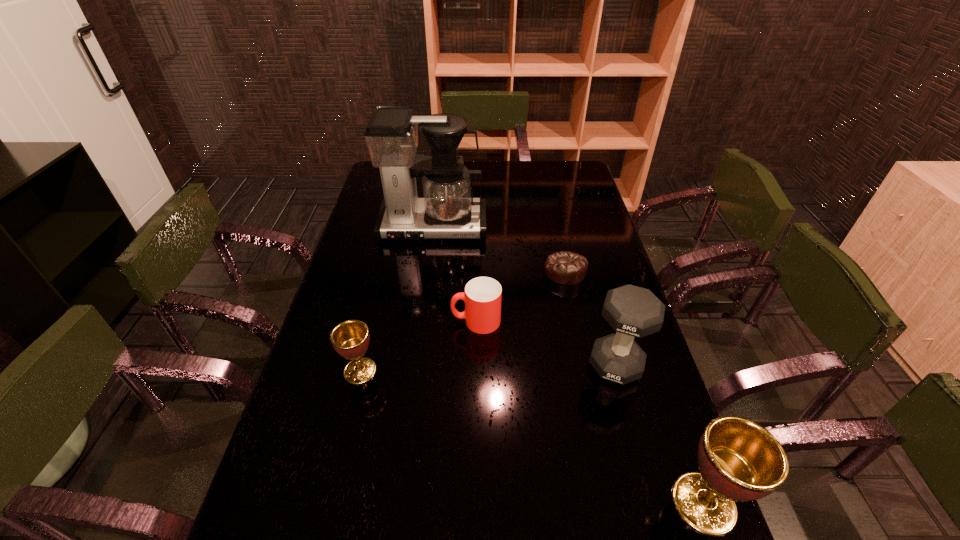
Where is `vacant area that lies between the shorter chalice and the dumbbell`? The width and height of the screenshot is (960, 540). vacant area that lies between the shorter chalice and the dumbbell is located at coordinates (488, 368).

Where is `vacant space that is in between the right chalice and the dumbbell`? This screenshot has height=540, width=960. vacant space that is in between the right chalice and the dumbbell is located at coordinates (660, 434).

Image resolution: width=960 pixels, height=540 pixels. I want to click on free space that is in between the cup and the beanbag, so click(520, 296).

This screenshot has height=540, width=960. Identify the location of free space that is in between the shorter chalice and the farthest object. (396, 299).

Where is `vacant space that's between the right chalice and the third farthest object`? vacant space that's between the right chalice and the third farthest object is located at coordinates tap(590, 412).

The width and height of the screenshot is (960, 540). What are the coordinates of `free space between the farthest object and the dumbbell` in the screenshot? It's located at (524, 296).

Identify the location of vacant area that lies between the farther chalice and the nearest object. (532, 437).

In order to click on free space between the farthest object and the dumbbell in this screenshot , I will do `click(524, 296)`.

You are a GUI agent. You are given a task and a screenshot of the screen. Output one action in this format:
    pyautogui.click(x=<x>, y=<y>)
    Task: Click on the vacant space that's between the fifth nearest object and the dumbbell
    This screenshot has width=960, height=540.
    Given the screenshot: What is the action you would take?
    pyautogui.click(x=590, y=318)

Find the location of `object identified as the fifth closest to the dumbbell`. object identified as the fifth closest to the dumbbell is located at coordinates (350, 339).